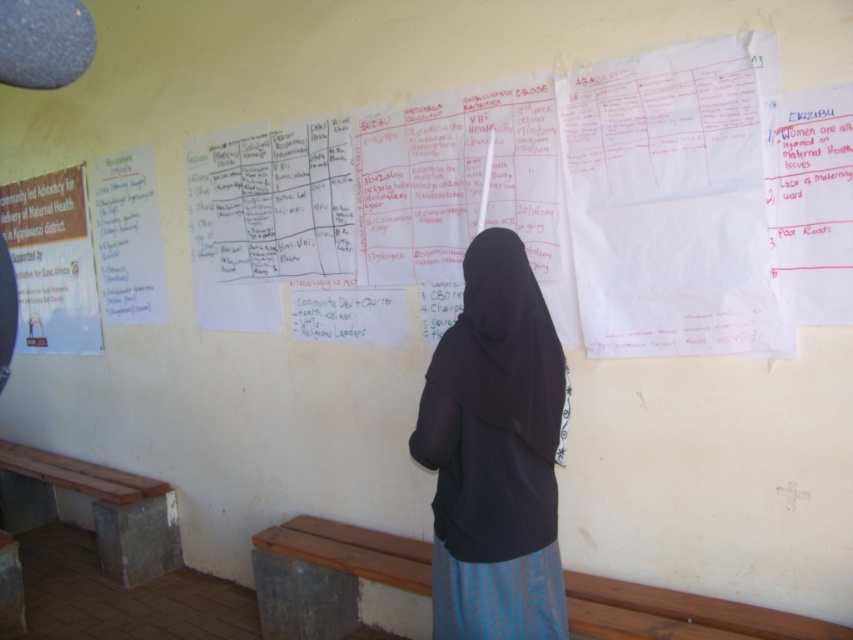
Looking at this image, can you confirm if black fabric at center is smaller than white paper poster at left?

Correct, black fabric at center occupies less space than white paper poster at left.

Does point (474, 356) come farther from viewer compared to point (44, 300)?

That is False.

Identify the location of black fabric at center. (495, 452).

Which is below, black fabric at center or wooden bench at lower center?

wooden bench at lower center is lower down.

Is point (416, 444) behind point (422, 554)?

No, (416, 444) is closer to viewer.

Where is `black fabric at center`? This screenshot has width=853, height=640. black fabric at center is located at coordinates (495, 452).

Who is lower down, wooden bench at lower left or white paper at left?

wooden bench at lower left is lower down.

Who is shorter, wooden bench at lower left or white paper at left?

wooden bench at lower left

Does point (103, 467) lie behind point (142, 280)?

Yes, it is behind point (142, 280).

Locate an element on the screen. wooden bench at lower left is located at coordinates (96, 509).